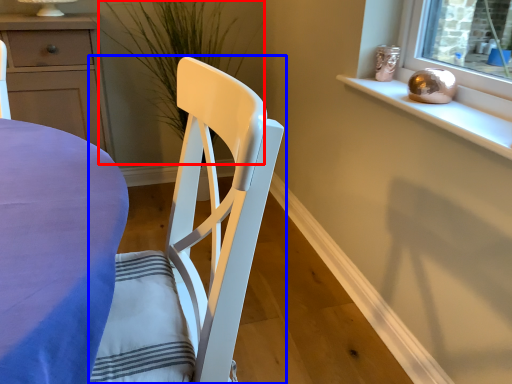
Question: Which object is further to the camera taking this photo, plant (highlighted by a red box) or chair (highlighted by a blue box)?

Choices:
 (A) plant
 (B) chair

Answer: (A)